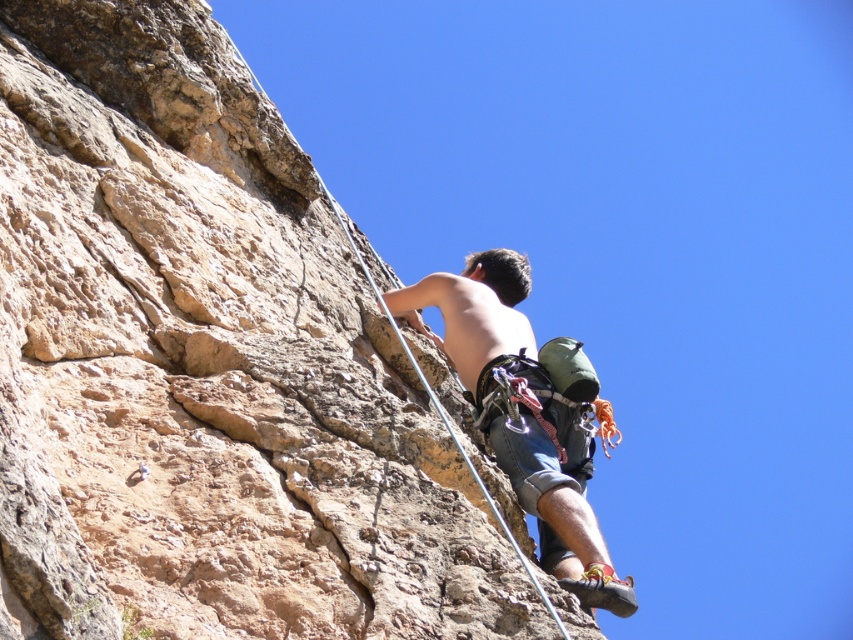
Looking at this image, you are a safety inspector assessing the rock climber. The safety guidelines state that the minimum safe distance between the climber and the rock face should be at least 30 feet to avoid collision during a fall. Given the distance between the brown rough rock at center and the shiny blue shorts at center, is the current position of the climber compliant with safety standards?

The distance between the brown rough rock at center and the shiny blue shorts at center is 28.28 feet, which is less than the required 30 feet. Therefore, the climber is not compliant with the safety standards as the distance is insufficient to prevent collision during a fall.

You are a photographer positioned at the base of the cliff. You want to capture a photo of the rock climber. Which of the two points, point (9, 440) or point (592, 522), appears closer to you in the image?

Point (9, 440) appears closer to you because it is closer to the camera than point (592, 522).

Looking at this image, you are a photographer positioned at the base of the cliff, aiming to capture the climber in a way that emphasizes the rock formation. Given the brown rough rock at center and the shiny blue shorts at center, which object should you focus on to highlight the height difference between them?

The brown rough rock at center has a greater height compared to the shiny blue shorts at center, so focusing on the brown rough rock at center will emphasize its taller stature against the shorter shiny blue shorts at center.